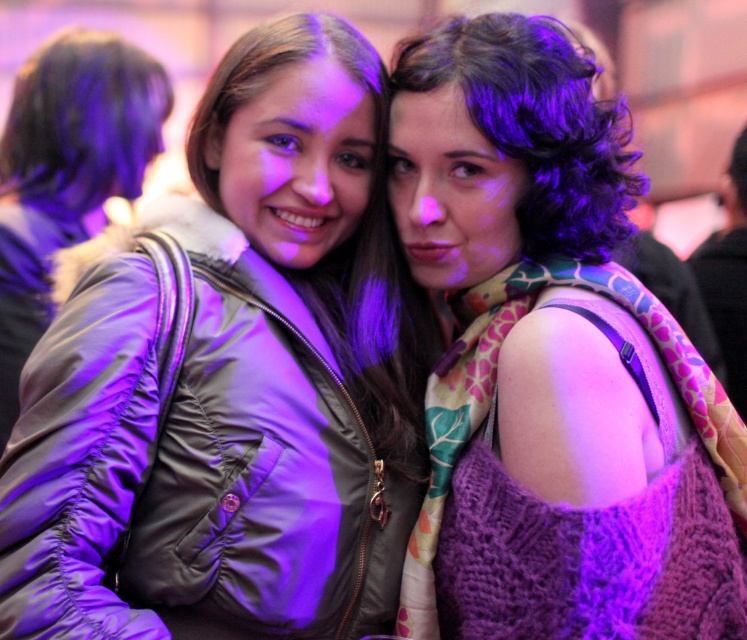
You are at a party and want to take a photo of the brownsmoothhair at center and the matte black jacket at left. If you stand facing them, which one should you point your camera towards first to capture both in the frame?

The brownsmoothhair at center is to the right of the matte black jacket at left, so you should point your camera towards the matte black jacket at left first to include both in the frame.

You are a photographer at the event and want to ensure both subjects are in focus. Since the matte black jacket at left is taller than the brownsmoothhair at center, which subject should you adjust the camera focus for first to account for their height difference?

Since the matte black jacket at left is taller than the brownsmoothhair at center, you should first adjust the camera focus for the matte black jacket at left to ensure proper focus on the taller subject before adjusting for the shorter one.